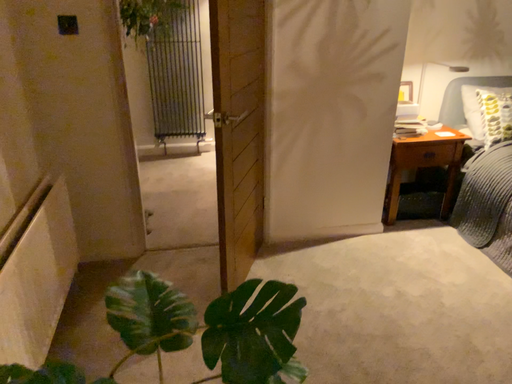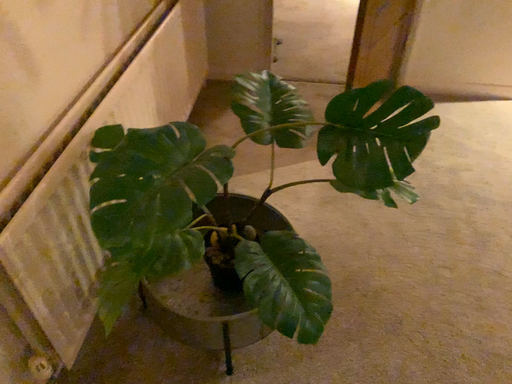
Question: How did the camera likely rotate when shooting the video?

Choices:
 (A) rotated right
 (B) rotated left

Answer: (B)